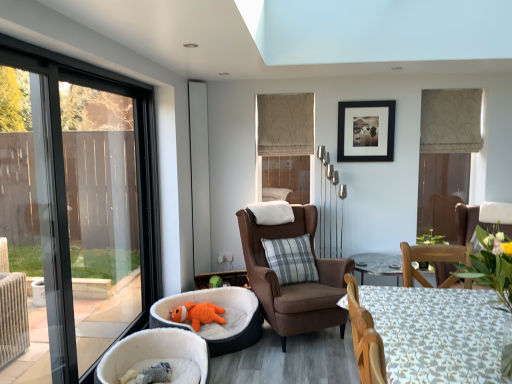
Question: Looking at their shapes, would you say white fabric table at lower right is wider or thinner than satin silver screen door at center?

Choices:
 (A) wide
 (B) thin

Answer: (A)

Question: In the image, is white fabric table at lower right on the left side or the right side of satin silver screen door at center?

Choices:
 (A) left
 (B) right

Answer: (B)

Question: Which object is the closest to the plaid fabric pillow at center?

Choices:
 (A) white plush pet bed at lower left, which ranks as the 2th chair in back-to-front order
 (B) black matte picture frame at upper center
 (C) satin silver screen door at center
 (D) orange corduroy pet bed at lower left
 (E) brown fabric chair at center, which appears as the second chair when viewed from the left

Answer: (E)

Question: Which is farther from the orange plush toy at lower left?

Choices:
 (A) satin silver screen door at center
 (B) white fabric table at lower right
 (C) brown fabric chair at center, which appears as the second chair when viewed from the left
 (D) white plush pet bed at lower left, the second chair when ordered from right to left
 (E) plaid fabric pillow at center

Answer: (B)